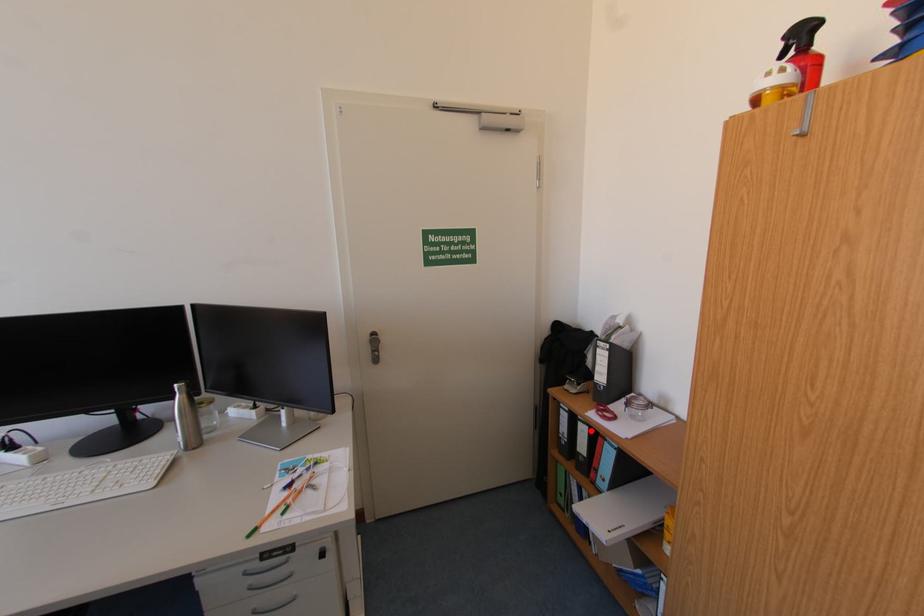
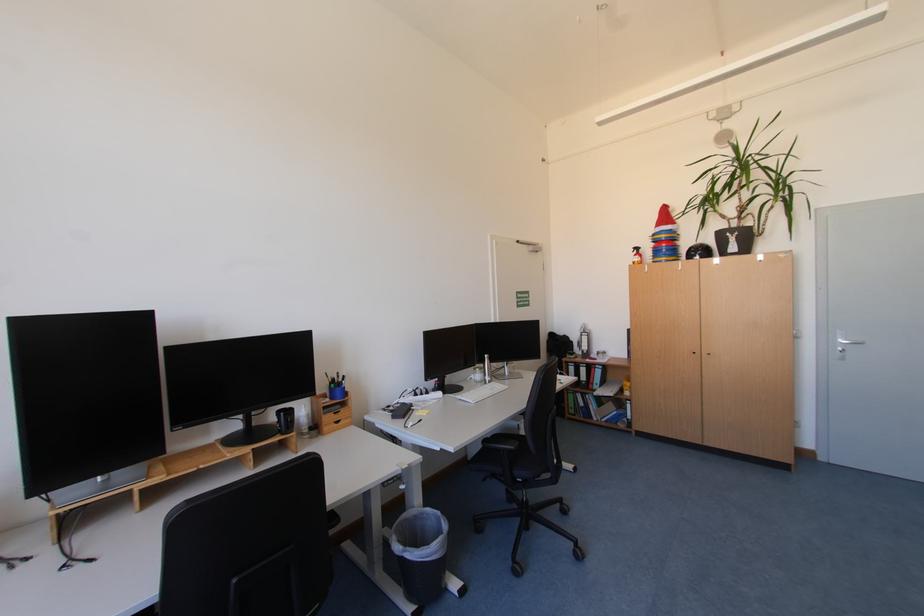
The point at the highlighted location is marked in the first image. Where is the corresponding point in the second image?

(590, 371)